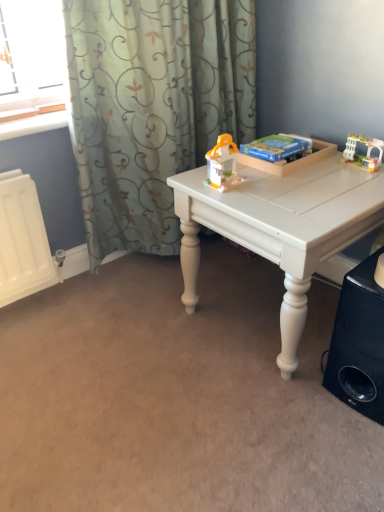
In order to click on free space in front of white plastic toy at upper right, the first toy when ordered from right to left in this screenshot , I will do `click(356, 182)`.